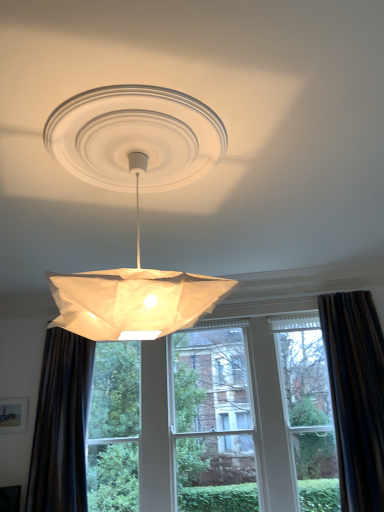
Question: Is dark brown textured curtain at left, the 1th curtain positioned from the left, not inside white paper lampshade at center?

Choices:
 (A) no
 (B) yes

Answer: (B)

Question: Is the depth of dark brown textured curtain at left, the second curtain from the right, greater than that of white paper lampshade at center?

Choices:
 (A) yes
 (B) no

Answer: (A)

Question: From the image's perspective, would you say dark brown textured curtain at left, the second curtain from the right, is positioned over white paper lampshade at center?

Choices:
 (A) yes
 (B) no

Answer: (B)

Question: Is dark brown textured curtain at left, the second curtain from the right, bigger than white paper lampshade at center?

Choices:
 (A) yes
 (B) no

Answer: (B)

Question: Does dark brown textured curtain at left, the 1th curtain positioned from the left, have a greater width compared to white paper lampshade at center?

Choices:
 (A) no
 (B) yes

Answer: (A)

Question: Is dark brown textured curtain at left, the second curtain from the right, aimed at white paper lampshade at center?

Choices:
 (A) no
 (B) yes

Answer: (A)

Question: Does dark fabric curtain at right, which appears as the second curtain when viewed from the left, turn towards dark brown textured curtain at left, the 1th curtain positioned from the left?

Choices:
 (A) yes
 (B) no

Answer: (B)

Question: Can you confirm if dark fabric curtain at right, which appears as the second curtain when viewed from the left, is positioned to the left of dark brown textured curtain at left, the second curtain from the right?

Choices:
 (A) yes
 (B) no

Answer: (B)

Question: Considering the relative sizes of dark fabric curtain at right, marked as the 1th curtain in a right-to-left arrangement, and dark brown textured curtain at left, the second curtain from the right, in the image provided, is dark fabric curtain at right, marked as the 1th curtain in a right-to-left arrangement, shorter than dark brown textured curtain at left, the second curtain from the right,?

Choices:
 (A) yes
 (B) no

Answer: (B)

Question: Does dark fabric curtain at right, marked as the 1th curtain in a right-to-left arrangement, have a greater width compared to dark brown textured curtain at left, the second curtain from the right?

Choices:
 (A) no
 (B) yes

Answer: (A)

Question: Is dark fabric curtain at right, marked as the 1th curtain in a right-to-left arrangement, positioned before dark brown textured curtain at left, the second curtain from the right?

Choices:
 (A) no
 (B) yes

Answer: (B)

Question: Considering the relative sizes of dark fabric curtain at right, marked as the 1th curtain in a right-to-left arrangement, and dark brown textured curtain at left, the 1th curtain positioned from the left, in the image provided, is dark fabric curtain at right, marked as the 1th curtain in a right-to-left arrangement, taller than dark brown textured curtain at left, the 1th curtain positioned from the left,?

Choices:
 (A) no
 (B) yes

Answer: (B)

Question: Is dark brown textured curtain at left, the second curtain from the right, completely or partially outside of dark fabric curtain at right, marked as the 1th curtain in a right-to-left arrangement?

Choices:
 (A) no
 (B) yes

Answer: (B)